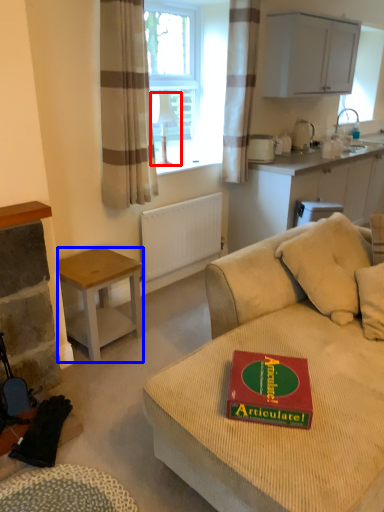
Question: Which point is closer to the camera, lamp (highlighted by a red box) or desk (highlighted by a blue box)?

Choices:
 (A) lamp
 (B) desk

Answer: (B)